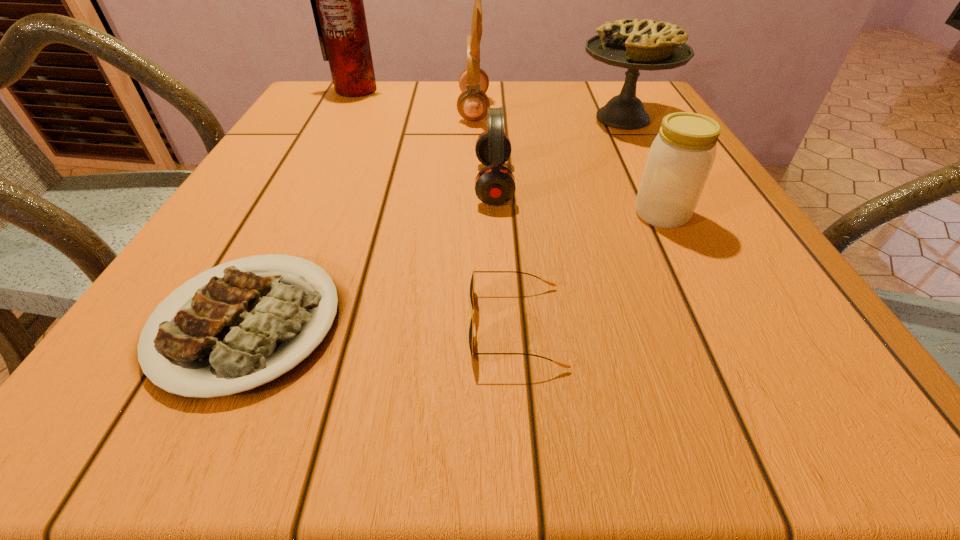
Identify which object is the second nearest to the tallest object. Please provide its 2D coordinates. Your answer should be formatted as a tuple, i.e. [(x, y)], where the tuple contains the x and y coordinates of a point satisfying the conditions above.

[(495, 184)]

Image resolution: width=960 pixels, height=540 pixels. I want to click on vacant area that satisfies the following two spatial constraints: 1. on the front-facing side of the second tallest object; 2. on the front side of the shortest object, so click(x=468, y=324).

At what (x,y) coordinates should I click in order to perform the action: click on free space that satisfies the following two spatial constraints: 1. on the nozzle side of the fire extinguisher; 2. on the right side of the plate. Please return your answer as a coordinate pair (x, y). Image resolution: width=960 pixels, height=540 pixels. Looking at the image, I should click on (233, 324).